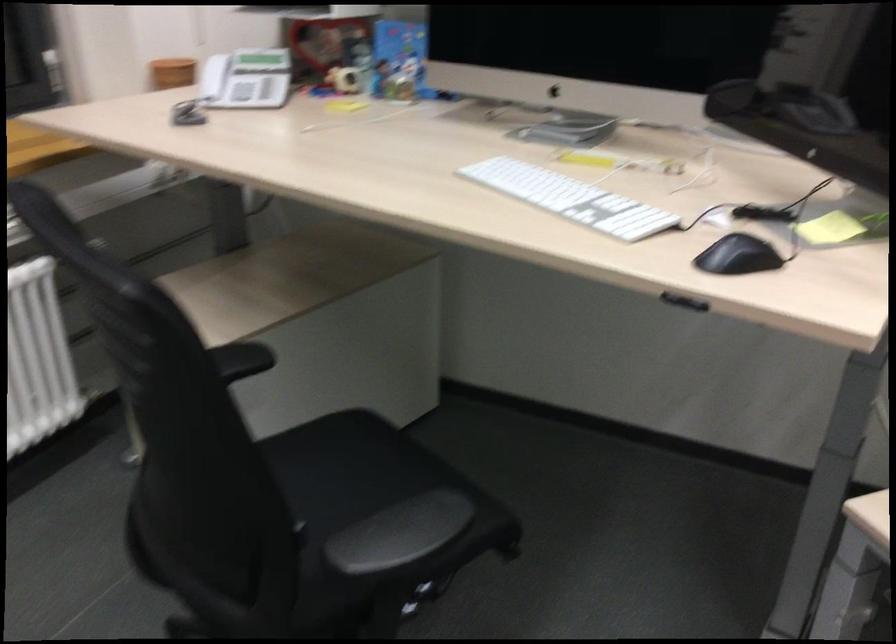
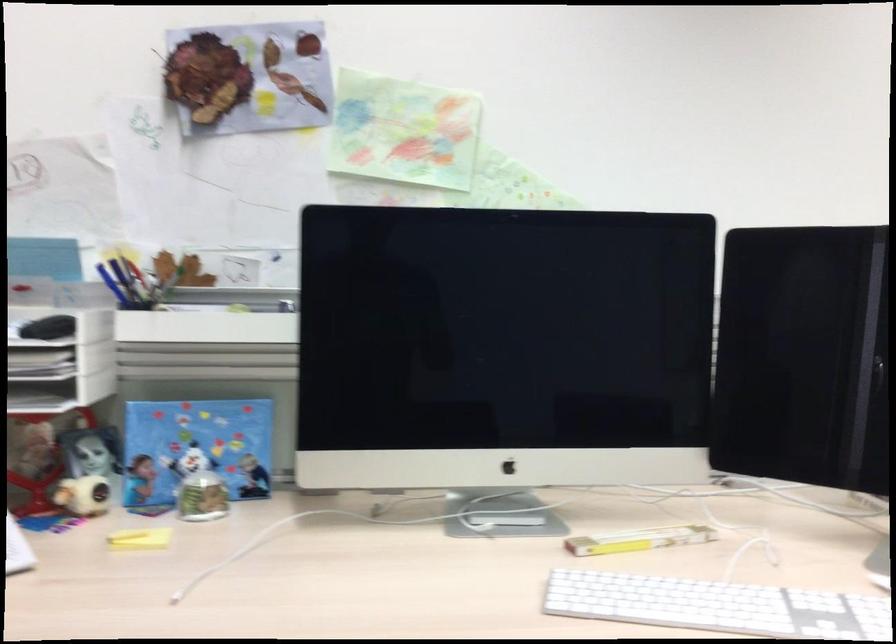
Where in the second image is the point corresponding to (x=613, y=158) from the first image?

(638, 540)